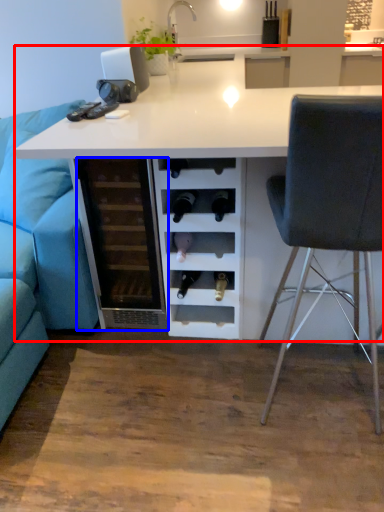
Question: Which object is closer to the camera taking this photo, table (highlighted by a red box) or file cabinet (highlighted by a blue box)?

Choices:
 (A) table
 (B) file cabinet

Answer: (A)